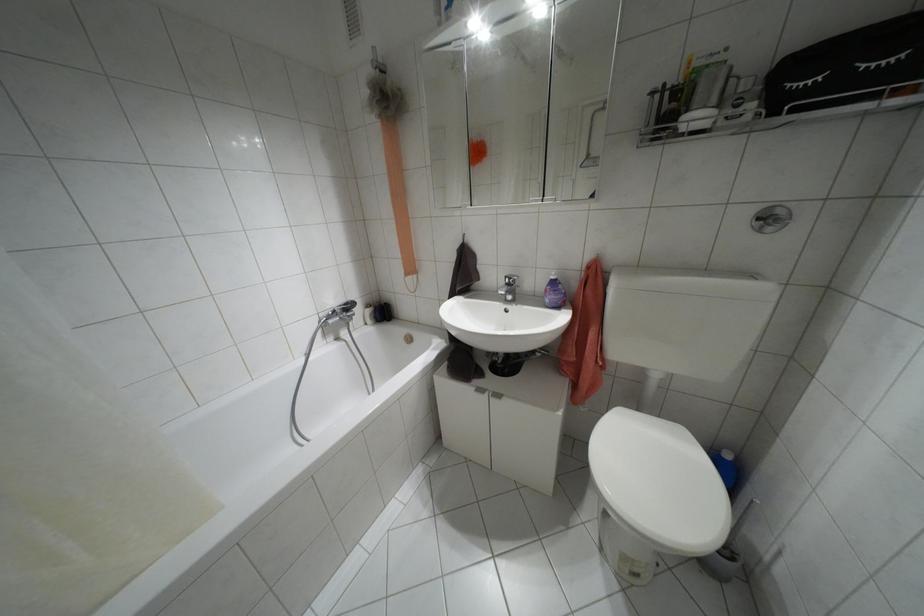
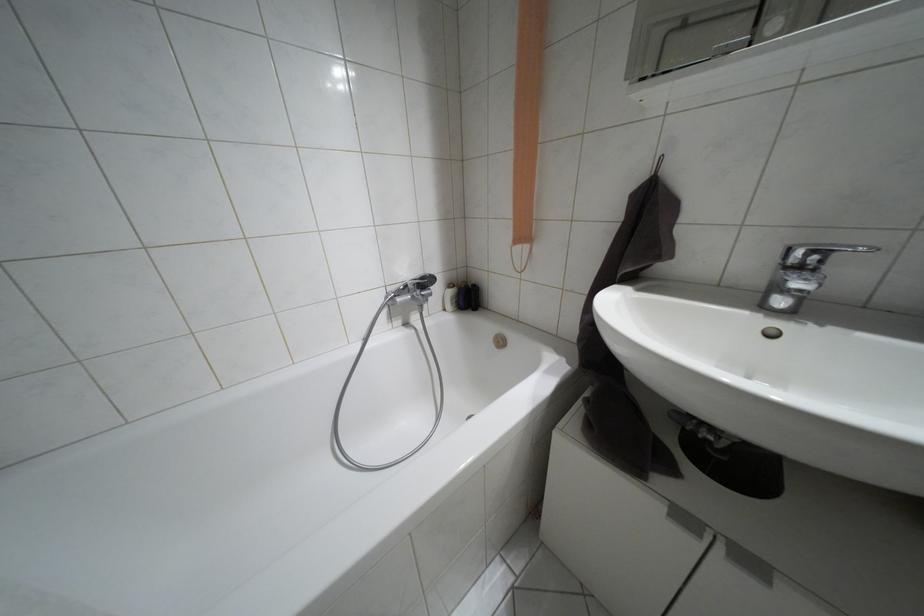
Find the pixel in the second image that matches (367,305) in the first image.

(448, 285)